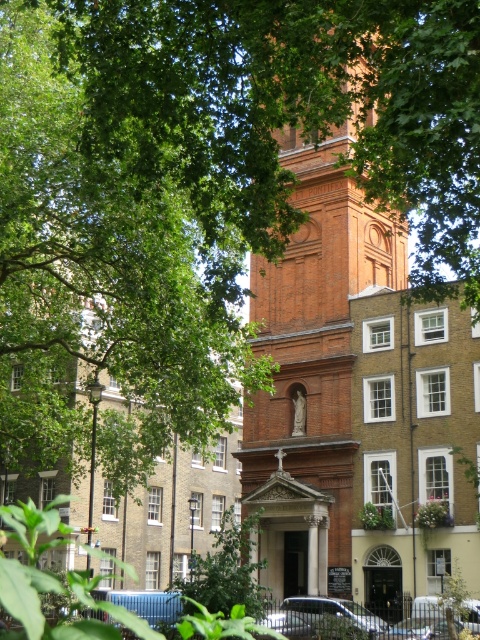
Question: Which point appears closest to the camera in this image?

Choices:
 (A) (468, 605)
 (B) (370, 620)

Answer: (A)

Question: Among these points, which one is nearest to the camera?

Choices:
 (A) (479, 618)
 (B) (364, 625)

Answer: (A)

Question: Is brick bell tower at center below metallic silver car at lower right?

Choices:
 (A) yes
 (B) no

Answer: (B)

Question: Where is brick bell tower at center located in relation to silver metallic car at center in the image?

Choices:
 (A) above
 (B) below

Answer: (A)

Question: Where is silver metallic car at center located in relation to metallic silver car at lower right in the image?

Choices:
 (A) right
 (B) left

Answer: (B)

Question: Estimate the real-world distances between objects in this image. Which object is closer to the brick bell tower at center?

Choices:
 (A) metallic silver car at lower right
 (B) silver metallic car at center

Answer: (B)